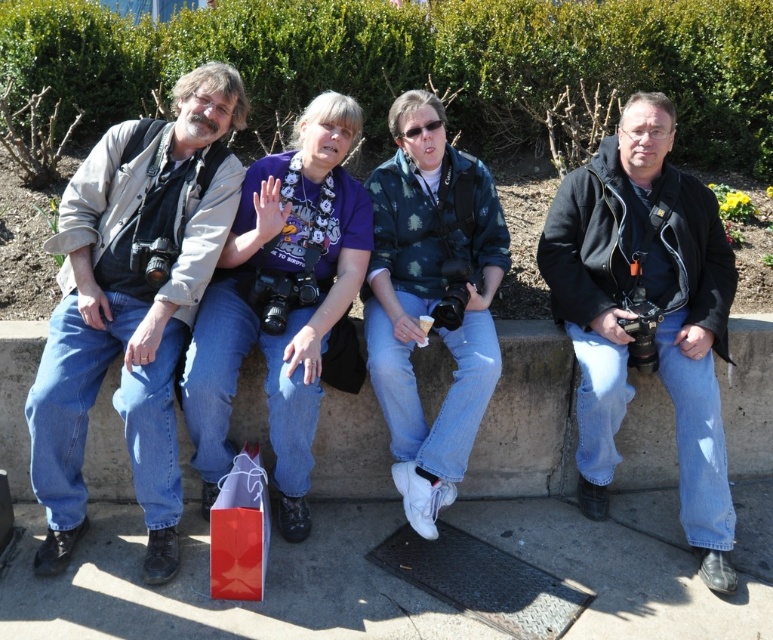
You are standing in front of the scene and want to place a 3 feet wide picnic basket on the smooth concrete at lower center. Can it fit?

The smooth concrete at lower center is 9.50 feet away from viewer, so the distance does not affect the width of the picnic basket. The basket can be placed as long as the surface is wide enough, but the description does not provide the width of the concrete. Therefore, it is unclear if the basket will fit.

You are a photographer who wants to place your matte red shopping bag at lower center on the concrete ledge at center. Based on the scene description, will the bag fit on the ledge without hanging over the edge?

The concrete ledge at center has a greater height compared to matte red shopping bag at lower center, so the bag will fit on the ledge without hanging over the edge.

You are a photographer who wants to place your matte red shopping bag at lower center on the concrete ledge at center. Can you fit it there?

The concrete ledge at center has a larger size compared to matte red shopping bag at lower center, so yes, the matte red shopping bag at lower center can fit on the concrete ledge at center.